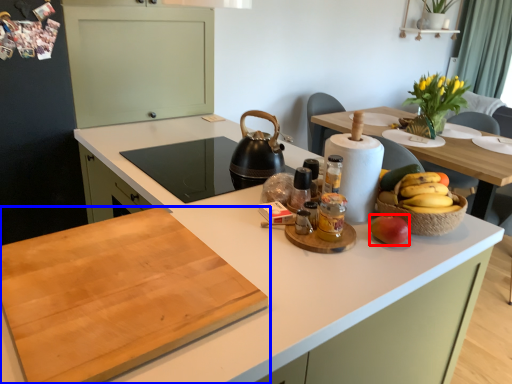
Question: Among these objects, which one is farthest to the camera, apple (highlighted by a red box) or countertop (highlighted by a blue box)?

Choices:
 (A) apple
 (B) countertop

Answer: (A)